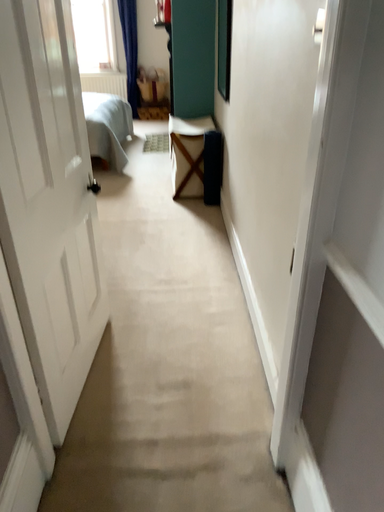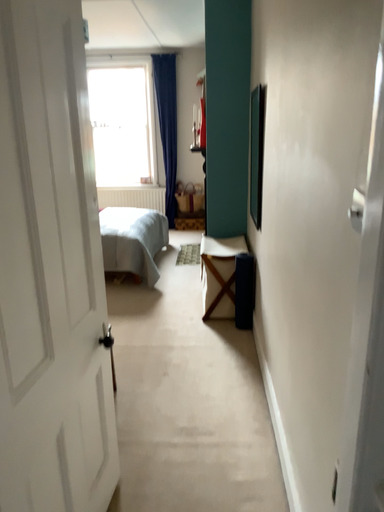
Question: How did the camera likely rotate when shooting the video?

Choices:
 (A) rotated upward
 (B) rotated downward

Answer: (A)